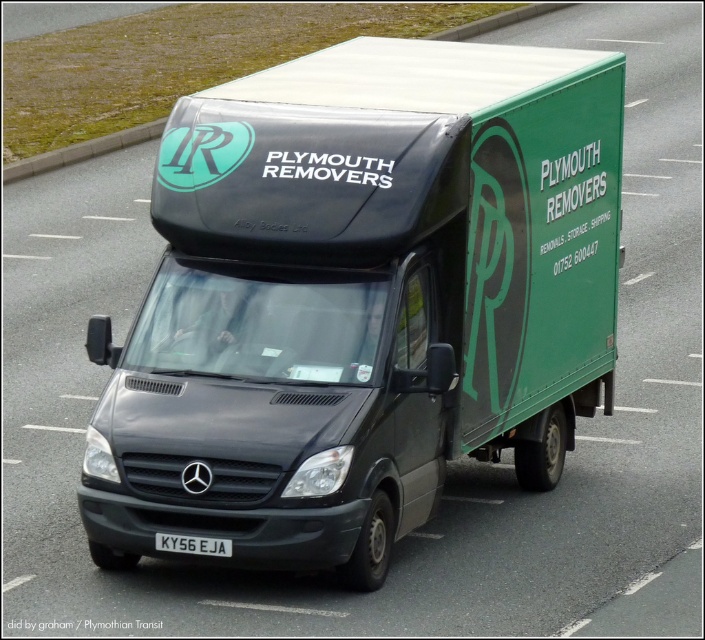
Between matte black van at center and white plastic license plate at center, which one is positioned higher?

matte black van at center

Can you confirm if matte black van at center is positioned to the left of white plastic license plate at center?

Incorrect, matte black van at center is not on the left side of white plastic license plate at center.

This screenshot has height=640, width=705. I want to click on matte black van at center, so click(x=360, y=300).